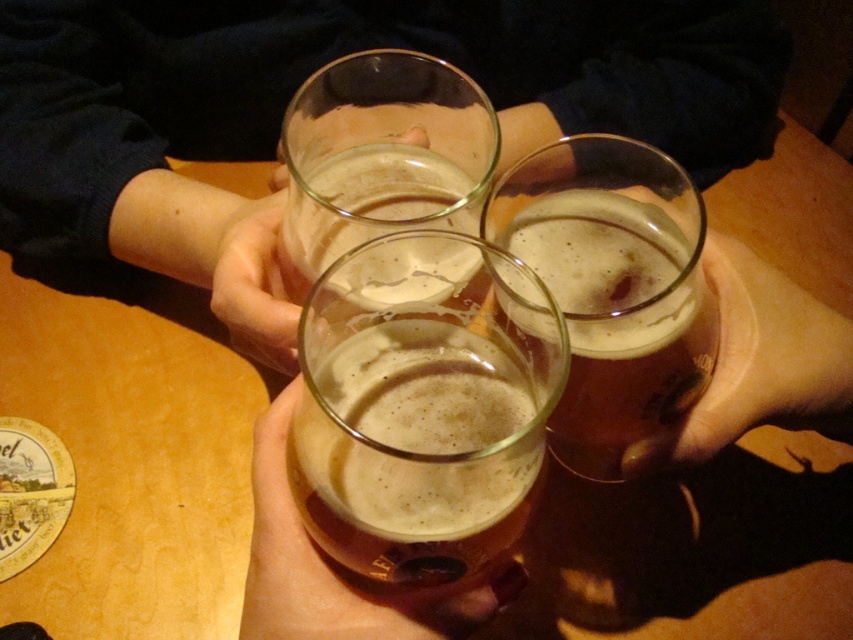
Question: Does clear glass beer at center appear on the left side of translucent glass at center?

Choices:
 (A) no
 (B) yes

Answer: (A)

Question: Among these objects, which one is farthest from the camera?

Choices:
 (A) translucent glass at center
 (B) clear glass beer at center

Answer: (B)

Question: Observing the image, what is the correct spatial positioning of translucent glass beer at center in reference to translucent glass at center?

Choices:
 (A) right
 (B) left

Answer: (A)

Question: Among these points, which one is farthest from the camera?

Choices:
 (A) (596, 339)
 (B) (196, 1)
 (C) (390, 134)

Answer: (B)

Question: Is translucent glass beer at center above translucent glass at center?

Choices:
 (A) no
 (B) yes

Answer: (A)

Question: Which point is closer to the camera?

Choices:
 (A) (525, 211)
 (B) (496, 417)
 (C) (115, 81)
 (D) (407, 68)

Answer: (B)